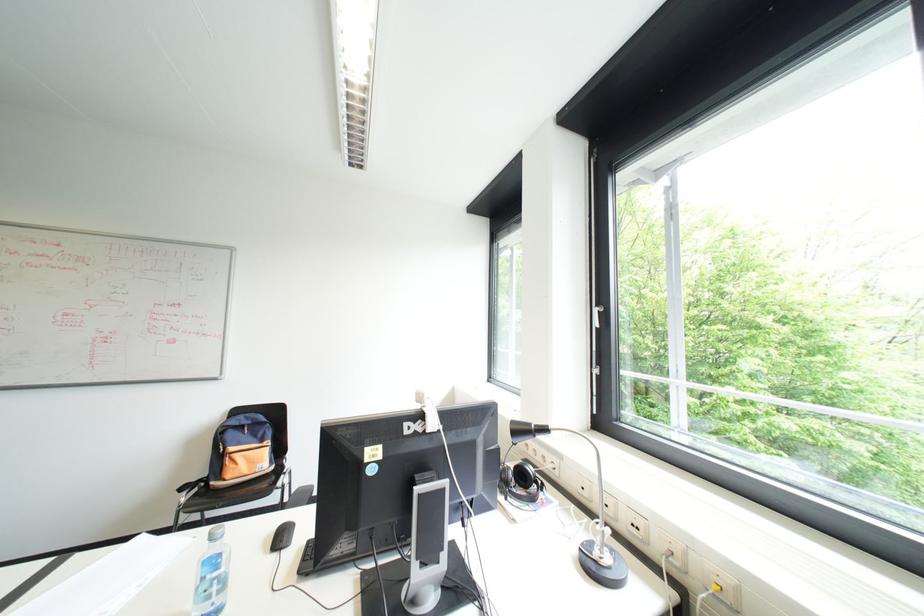
At what (x,y) coordinates should I click in order to perform the action: click on black chair armrest. Please return your answer as a coordinate pair (x, y). The image size is (924, 616). Looking at the image, I should click on 191,485.